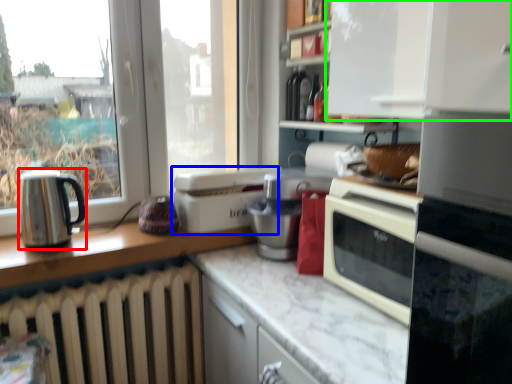
Question: Which object is positioned farthest from kitchen appliance (highlighted by a red box)? Select from kitchen appliance (highlighted by a blue box) and cabinetry (highlighted by a green box).

Choices:
 (A) kitchen appliance
 (B) cabinetry

Answer: (B)